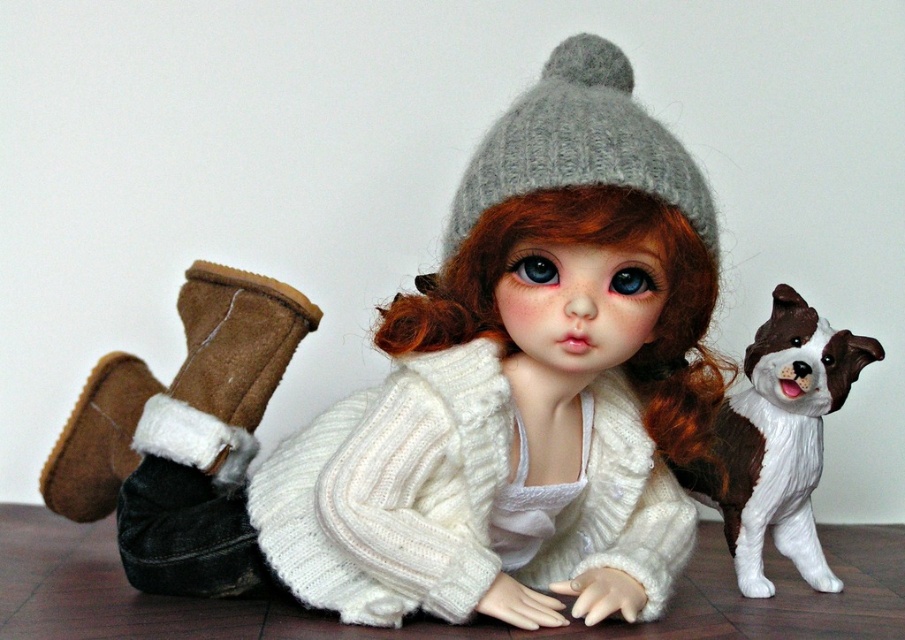
Question: Which of the following is the farthest from the observer?

Choices:
 (A) white knitted sweater at center
 (B) brown suede boot at lower left
 (C) brown and white plastic dog at right

Answer: (B)

Question: In this image, where is white knitted sweater at center located relative to brown suede boot at lower left?

Choices:
 (A) left
 (B) right

Answer: (B)

Question: Which point appears closest to the camera in this image?

Choices:
 (A) [x=700, y=492]
 (B) [x=475, y=272]

Answer: (B)

Question: Considering the relative positions of gray knitted hat at center and brown suede boot at lower left in the image provided, where is gray knitted hat at center located with respect to brown suede boot at lower left?

Choices:
 (A) above
 (B) below

Answer: (A)

Question: Is gray knitted hat at center positioned before brown suede boot at lower left?

Choices:
 (A) yes
 (B) no

Answer: (A)

Question: Which of the following is the farthest from the observer?

Choices:
 (A) (594, 132)
 (B) (770, 337)
 (C) (470, 193)
 (D) (236, 308)

Answer: (B)